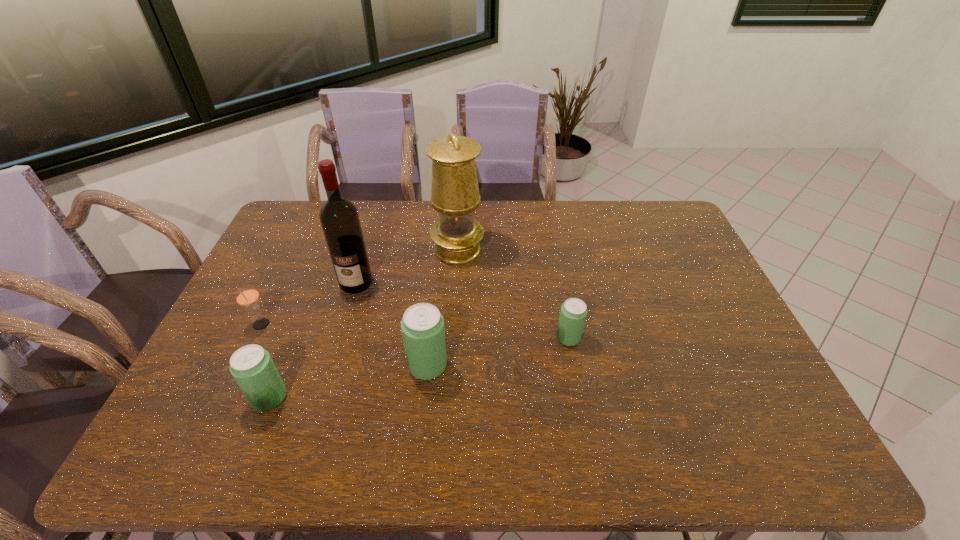
Where is `object that can be found as the fourth closest to the fifth nearest object`? The image size is (960, 540). object that can be found as the fourth closest to the fifth nearest object is located at coordinates (253, 369).

You are a GUI agent. You are given a task and a screenshot of the screen. Output one action in this format:
    pyautogui.click(x=<x>, y=<y>)
    Task: Click on the object that stands as the fifth closest to the farthest soda
    
    Given the screenshot: What is the action you would take?
    pyautogui.click(x=247, y=296)

Point out which soda is positioned as the nearest to the shortest object. Please provide its 2D coordinates. Your answer should be formatted as a tuple, i.e. [(x, y)], where the tuple contains the x and y coordinates of a point satisfying the conditions above.

[(422, 325)]

Locate which soda ranks in proximity to the straw. Please provide its 2D coordinates. Your answer should be formatted as a tuple, i.e. [(x, y)], where the tuple contains the x and y coordinates of a point satisfying the conditions above.

[(253, 369)]

The image size is (960, 540). I want to click on free space that satisfies the following two spatial constraints: 1. on the front and back of the rightmost object; 2. on the left side of the alcohol, so click(x=340, y=338).

At what (x,y) coordinates should I click in order to perform the action: click on vacant area in the image that satisfies the following two spatial constraints: 1. on the front and back of the rightmost object; 2. on the right side of the alcohol. Please return your answer as a coordinate pair (x, y). The height and width of the screenshot is (540, 960). Looking at the image, I should click on (340, 338).

Where is `vacant space that satisfies the following two spatial constraints: 1. on the front side of the leftmost object; 2. on the right side of the second tallest soda`? This screenshot has width=960, height=540. vacant space that satisfies the following two spatial constraints: 1. on the front side of the leftmost object; 2. on the right side of the second tallest soda is located at coordinates (227, 397).

Locate an element on the screen. This screenshot has width=960, height=540. free space that satisfies the following two spatial constraints: 1. on the front side of the tallest soda; 2. on the right side of the straw is located at coordinates (241, 366).

The height and width of the screenshot is (540, 960). I want to click on free space that satisfies the following two spatial constraints: 1. on the front and back of the alcohol; 2. on the left side of the farthest soda, so click(340, 338).